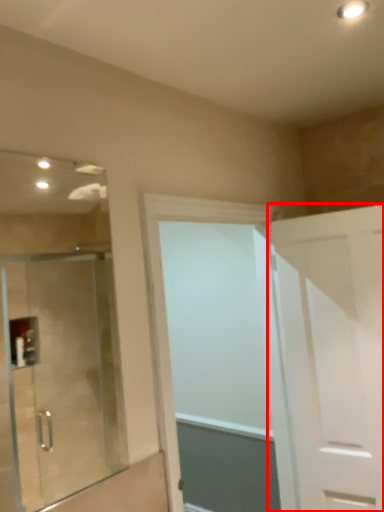
Question: Considering the relative positions of door (annotated by the red box) and door in the image provided, where is door (annotated by the red box) located with respect to the staircase?

Choices:
 (A) right
 (B) left

Answer: (A)